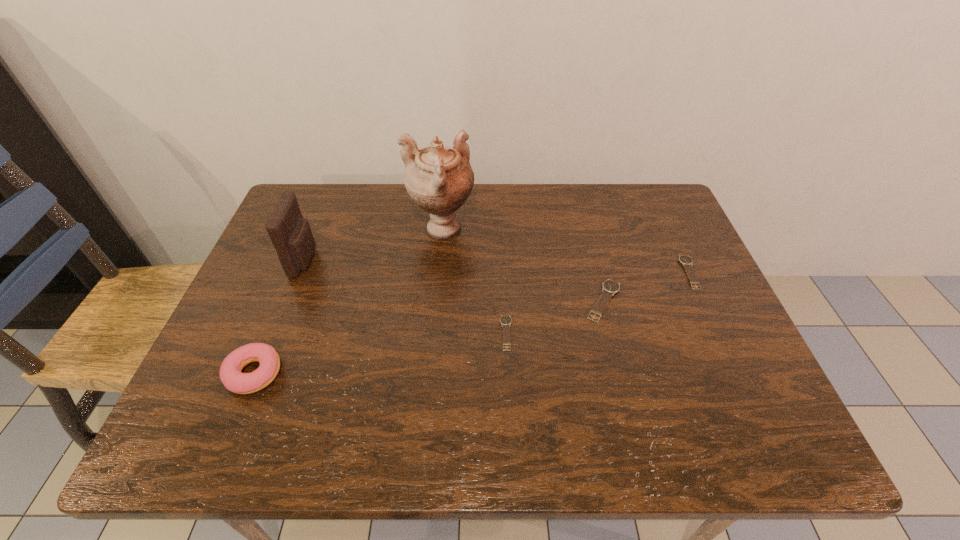
Locate an element on the screen. the fourth object from left to right is located at coordinates 505,320.

The image size is (960, 540). I want to click on the leftmost watch, so click(x=505, y=320).

Locate an element on the screen. This screenshot has height=540, width=960. the fifth object from left to right is located at coordinates (609, 287).

The image size is (960, 540). I want to click on the second watch from left to right, so click(x=609, y=287).

Identify the location of the fifth tallest object. The height and width of the screenshot is (540, 960). (685, 260).

Where is `the rightmost watch`? the rightmost watch is located at coordinates (685, 260).

At what (x,y) coordinates should I click in order to perform the action: click on pouch. Please return your answer as a coordinate pair (x, y). This screenshot has width=960, height=540. Looking at the image, I should click on (291, 235).

Find the location of a particular element. The image size is (960, 540). the tallest object is located at coordinates (439, 179).

Where is `the third object from left to right`? This screenshot has height=540, width=960. the third object from left to right is located at coordinates (439, 179).

The width and height of the screenshot is (960, 540). In order to click on the third tallest object in this screenshot , I will do `click(231, 376)`.